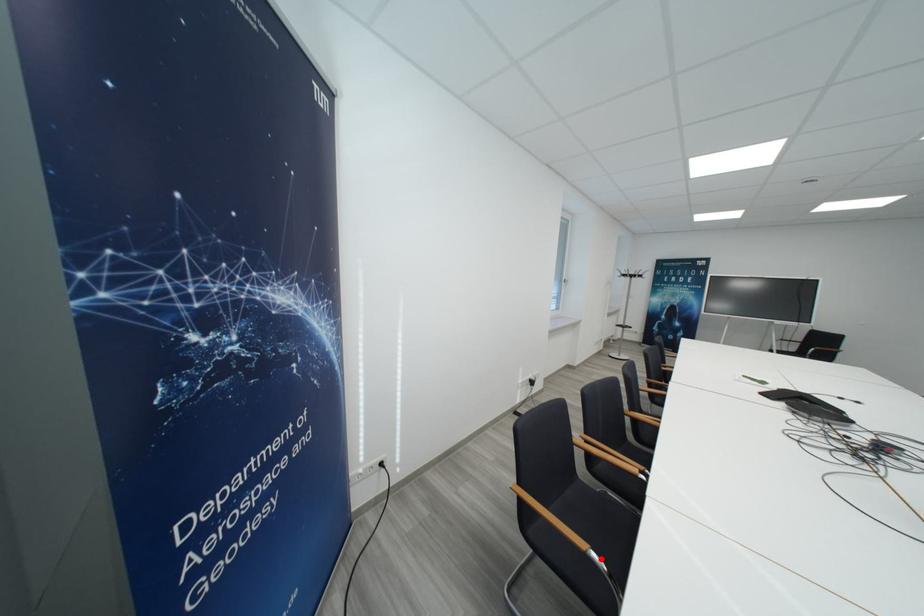
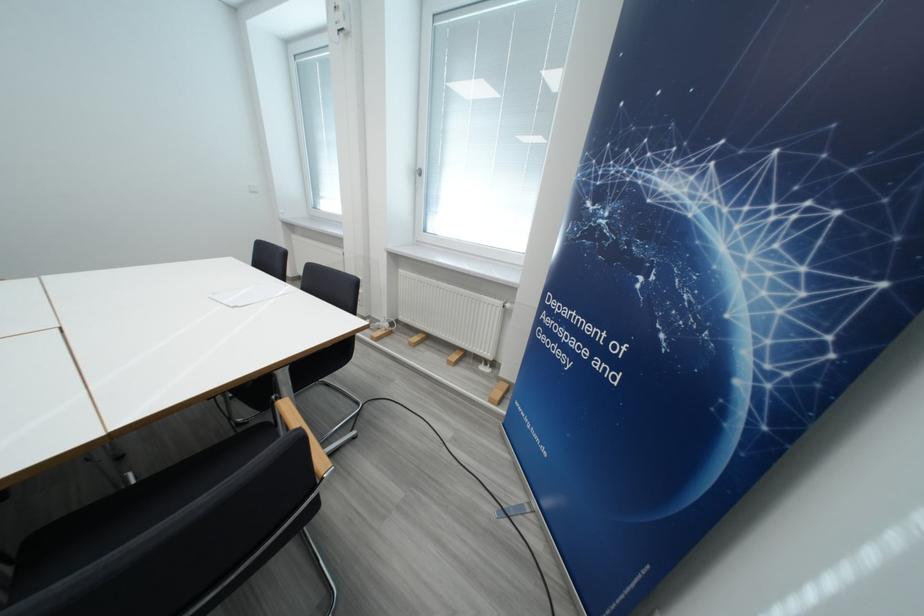
Question: I am providing you with two images of the same scene from different viewpoints. A red point is marked on the first image. Can you still see the location of the red point in image 2?

Choices:
 (A) Yes
 (B) No

Answer: (B)